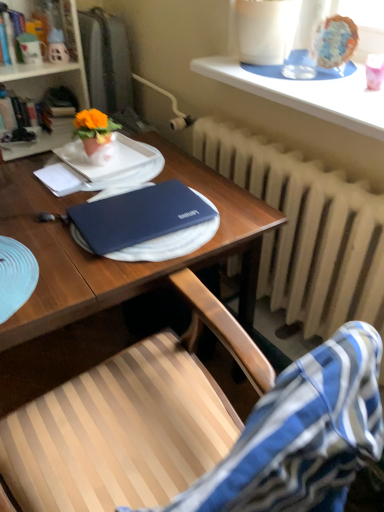
Where is `free location to the right of matte orange flowerpot at upper left`? The height and width of the screenshot is (512, 384). free location to the right of matte orange flowerpot at upper left is located at coordinates click(136, 156).